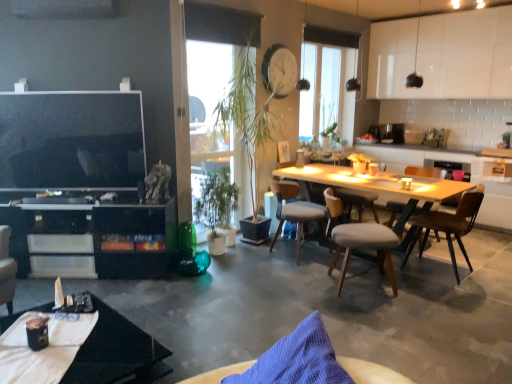
What do you see at coordinates (279, 70) in the screenshot?
I see `white glossy clock at upper center` at bounding box center [279, 70].

The image size is (512, 384). Describe the element at coordinates (333, 310) in the screenshot. I see `concreteroughfloor at lower center` at that location.

This screenshot has width=512, height=384. Describe the element at coordinates (448, 226) in the screenshot. I see `brown wooden chair at center, the fourth chair viewed from the left` at that location.

Find the location of `black glass coffee table at lower left`. black glass coffee table at lower left is located at coordinates [x=117, y=353].

The image size is (512, 384). What do you see at coordinates (117, 353) in the screenshot? I see `black glass coffee table at lower left` at bounding box center [117, 353].

What are the coordinates of `black glossy coffee machine at upper center` in the screenshot? It's located at pyautogui.click(x=392, y=133).

Locate an element on the screen. This screenshot has width=512, height=384. white glossy clock at upper center is located at coordinates (279, 70).

Between concreteroughfloor at lower center and blue fabric chair at lower center, the 4th chair viewed from the back, which one has less height?

With less height is blue fabric chair at lower center, the 4th chair viewed from the back.

Looking at the image, does concreteroughfloor at lower center seem bigger or smaller compared to blue fabric chair at lower center, which is counted as the 4th chair, starting from the right?

In the image, concreteroughfloor at lower center appears to be larger than blue fabric chair at lower center, which is counted as the 4th chair, starting from the right.

Considering the positions of point (340, 311) and point (316, 371), is point (340, 311) closer or farther from the camera than point (316, 371)?

Point (340, 311) appears to be farther away from the viewer than point (316, 371).

Could you tell me if beige fabric chair at center, the second chair viewed from the right, is turned towards black glass pendant light at upper center, the 2th lamp from the front?

No.

Which is in front, point (375, 249) or point (305, 20)?

The point (375, 249) is more forward.

Is beige fabric chair at center, the second chair viewed from the right, far from black glass pendant light at upper center, which is the first lamp in left-to-right order?

Yes.

Consider the image. Can we say beige fabric chair at center, the second chair viewed from the right, lies outside black glass pendant light at upper center, which is the first lamp from back to front?

Yes, beige fabric chair at center, the second chair viewed from the right, is outside of black glass pendant light at upper center, which is the first lamp from back to front.

Is black glass pendant light at upper center, which ranks as the 2th lamp in right-to-left order, inside white glossy clock at upper center?

No.

Considering the relative sizes of white glossy clock at upper center and black glass pendant light at upper center, the 2th lamp from the front, in the image provided, is white glossy clock at upper center taller than black glass pendant light at upper center, the 2th lamp from the front,?

No.

From a real-world perspective, is white glossy clock at upper center located beneath black glass pendant light at upper center, which is the first lamp in left-to-right order?

Yes, from a real-world perspective, white glossy clock at upper center is below black glass pendant light at upper center, which is the first lamp in left-to-right order.

From the image's perspective, is white glossy clock at upper center positioned above or below black glass pendant light at upper center, which is the first lamp from back to front?

Based on their image positions, white glossy clock at upper center is located beneath black glass pendant light at upper center, which is the first lamp from back to front.

Considering the relative sizes of black glass pendant light at upper center, which ranks as the 2th lamp in right-to-left order, and green leafy plant at center in the image provided, is black glass pendant light at upper center, which ranks as the 2th lamp in right-to-left order, wider than green leafy plant at center?

No.

Which object is positioned more to the right, black glass pendant light at upper center, the 2th lamp from the front, or green leafy plant at center?

black glass pendant light at upper center, the 2th lamp from the front, is more to the right.

How far apart are black glass pendant light at upper center, which ranks as the 2th lamp in right-to-left order, and green leafy plant at center?

black glass pendant light at upper center, which ranks as the 2th lamp in right-to-left order, and green leafy plant at center are 1.56 meters apart from each other.

Which is behind, point (304, 37) or point (241, 50)?

Point (304, 37)

Can you confirm if black glass coffee table at lower left is smaller than brown wooden chair at center, which is the 3th chair from front to back?

Yes, black glass coffee table at lower left is smaller than brown wooden chair at center, which is the 3th chair from front to back.

The width and height of the screenshot is (512, 384). Find the location of `coffee table below the brown wooden chair at center, which is the 3th chair from front to back (from a real-world perspective)`. coffee table below the brown wooden chair at center, which is the 3th chair from front to back (from a real-world perspective) is located at coordinates (117, 353).

Considering the sizes of objects black glass coffee table at lower left and brown wooden chair at center, the fourth chair viewed from the left, in the image provided, who is thinner, black glass coffee table at lower left or brown wooden chair at center, the fourth chair viewed from the left,?

Thinner between the two is brown wooden chair at center, the fourth chair viewed from the left.

From the image's perspective, relative to concreteroughfloor at lower center, is green matte plant at center above or below?

From the image's perspective, green matte plant at center appears above concreteroughfloor at lower center.

Which object is closer to the camera taking this photo, green matte plant at center or concreteroughfloor at lower center?

Positioned in front is concreteroughfloor at lower center.

The image size is (512, 384). Find the location of `concrete to the right of green matte plant at center`. concrete to the right of green matte plant at center is located at coordinates (333, 310).

In order to click on window screen above the black glossy cabinet at lower left (from the image's perspective) in this screenshot , I will do `click(328, 83)`.

Does transparent glass window at center have a smaller size compared to black glossy cabinet at lower left?

Indeed, transparent glass window at center has a smaller size compared to black glossy cabinet at lower left.

Could you tell me if transparent glass window at center is turned towards black glossy cabinet at lower left?

No, transparent glass window at center is not turned towards black glossy cabinet at lower left.

Identify the location of concrete that appears in front of the blue fabric chair at lower center, the 4th chair viewed from the back. (333, 310).

From the image's perspective, count 2nd lamps upward from the beige fabric chair at center, the 3th chair viewed from the left, and point to it. Please provide its 2D coordinates.

[(302, 83)]

Which object lies nearer to the anchor point light gray fabric chair at center, which is the first chair in back-to-front order, transparent glass window at center or brown wooden chair at center, the 1th chair viewed from the right?

brown wooden chair at center, the 1th chair viewed from the right, is positioned closer to the anchor light gray fabric chair at center, which is the first chair in back-to-front order.

Looking at this image, based on their spatial positions, is brown wooden chair at center, the fourth chair viewed from the left, or matte black coffee cup at lower left closer to light gray fabric chair at center, which is the 4th chair in front-to-back order?

brown wooden chair at center, the fourth chair viewed from the left, is closer to light gray fabric chair at center, which is the 4th chair in front-to-back order.

Looking at the image, which one is located closer to black matte pendant light at upper right, positioned as the second lamp in back-to-front order, white glossy clock at upper center or brown wooden chair at center, the 2th chair positioned from the back?

white glossy clock at upper center is closer to black matte pendant light at upper right, positioned as the second lamp in back-to-front order.

Estimate the real-world distances between objects in this image. Which object is closer to black glossy cabinet at lower left, light gray fabric chair at center, which is the 4th chair in front-to-back order, or black matte pendant light at upper right, which is counted as the 2th lamp, starting from the left?

light gray fabric chair at center, which is the 4th chair in front-to-back order.

Looking at the image, which one is located further to black matte pendant light at upper right, which is counted as the 2th lamp, starting from the left, white glossy clock at upper center or blue fabric chair at lower center, positioned as the first chair in left-to-right order?

The object further to black matte pendant light at upper right, which is counted as the 2th lamp, starting from the left, is blue fabric chair at lower center, positioned as the first chair in left-to-right order.

From the image, which object appears to be farther from green leafy plant at center, green matte plant at center or black glass pendant light at upper center, which is the first lamp from back to front?

black glass pendant light at upper center, which is the first lamp from back to front, is positioned further to the anchor green leafy plant at center.

When comparing their distances from matte black coffee cup at lower left, does black glass coffee table at lower left or black glossy cabinet at lower left seem further?

black glossy cabinet at lower left is positioned further to the anchor matte black coffee cup at lower left.

Estimate the real-world distances between objects in this image. Which object is closer to matte black coffee cup at lower left, black glossy coffee machine at upper center or light gray fabric chair at center, acting as the 2th chair starting from the left?

light gray fabric chair at center, acting as the 2th chair starting from the left.

Find the location of `plant between white glossy clock at upper center and green matte plant at center from top to bottom`. plant between white glossy clock at upper center and green matte plant at center from top to bottom is located at coordinates (255, 102).

In order to click on coffee cup positioned between blue fabric chair at lower center, the first chair positioned from the front, and black glass pendant light at upper center, which ranks as the 2th lamp in right-to-left order, from near to far in this screenshot , I will do `click(37, 333)`.

The image size is (512, 384). I want to click on lamp between black glass pendant light at upper center, the 2th lamp from the front, and matte black coffee cup at lower left in the up-down direction, so (354, 80).

Where is `coffee cup between concreteroughfloor at lower center and light gray fabric chair at center, the 3th chair when ordered from right to left, from front to back`? coffee cup between concreteroughfloor at lower center and light gray fabric chair at center, the 3th chair when ordered from right to left, from front to back is located at coordinates (37, 333).